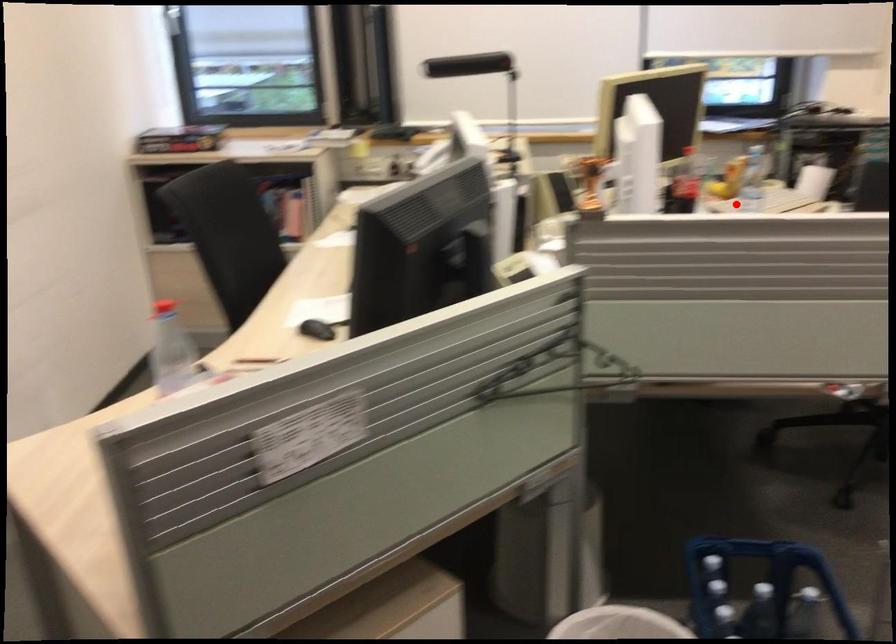
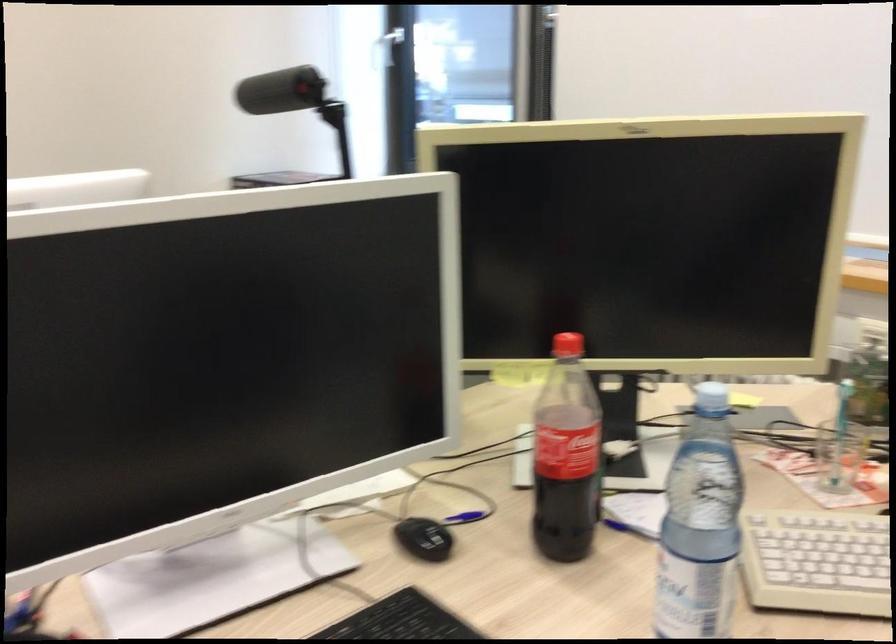
Question: I am providing you with two images of the same scene from different viewpoints. A red point is shown in image1. For the corresponding object point in image2, is it positioned nearer or farther from the camera?

Choices:
 (A) Nearer
 (B) Farther

Answer: (A)